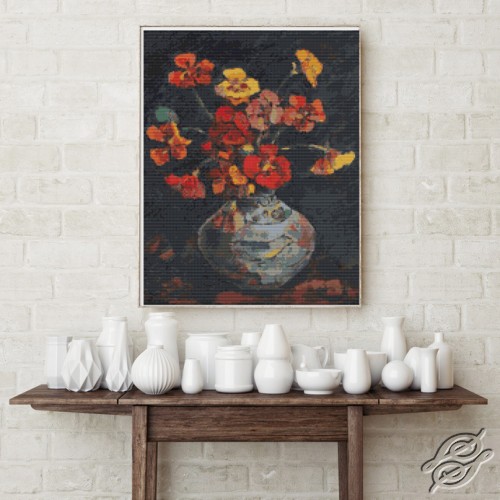
Find the location of a particular element. wall is located at coordinates (407, 123).